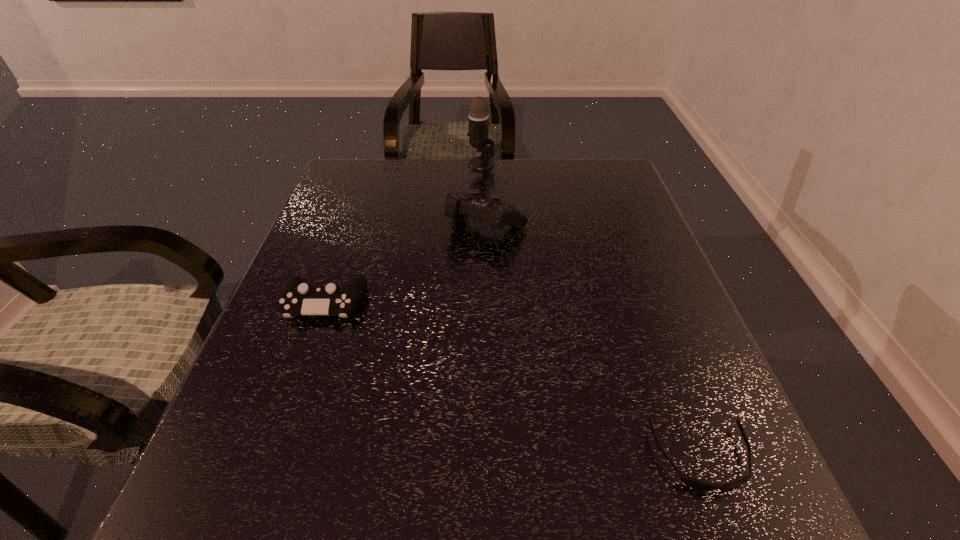
At what (x,y) coordinates should I click in order to perform the action: click on the farthest object. Please return your answer as a coordinate pair (x, y). Looking at the image, I should click on (478, 133).

Find the location of `the tallest object`. the tallest object is located at coordinates (478, 133).

Find the location of a particular element. The width and height of the screenshot is (960, 540). the third shortest object is located at coordinates (499, 214).

Locate an element on the screen. the right control is located at coordinates (499, 214).

Locate an element on the screen. This screenshot has height=540, width=960. the left control is located at coordinates (298, 298).

Image resolution: width=960 pixels, height=540 pixels. What are the coordinates of `the nearer control` in the screenshot? It's located at (298, 298).

Identify the location of the rightmost object. The width and height of the screenshot is (960, 540). (695, 484).

At what (x,y) coordinates should I click in order to perform the action: click on the nearest object. Please return your answer as a coordinate pair (x, y). Looking at the image, I should click on (695, 484).

Where is `vacant space situated on the front of the microphone`? This screenshot has height=540, width=960. vacant space situated on the front of the microphone is located at coordinates (482, 241).

This screenshot has width=960, height=540. Identify the location of free space located on the back of the right control. (486, 185).